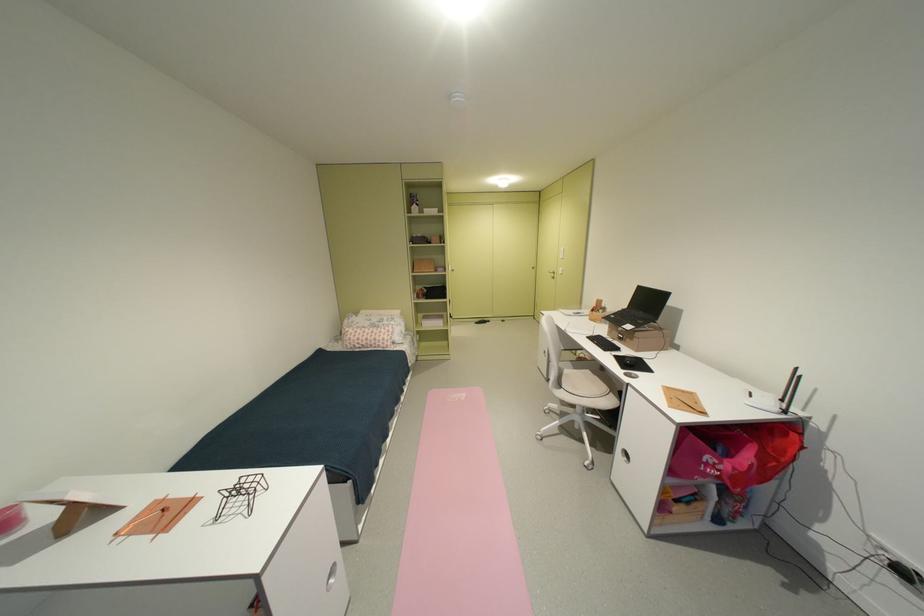
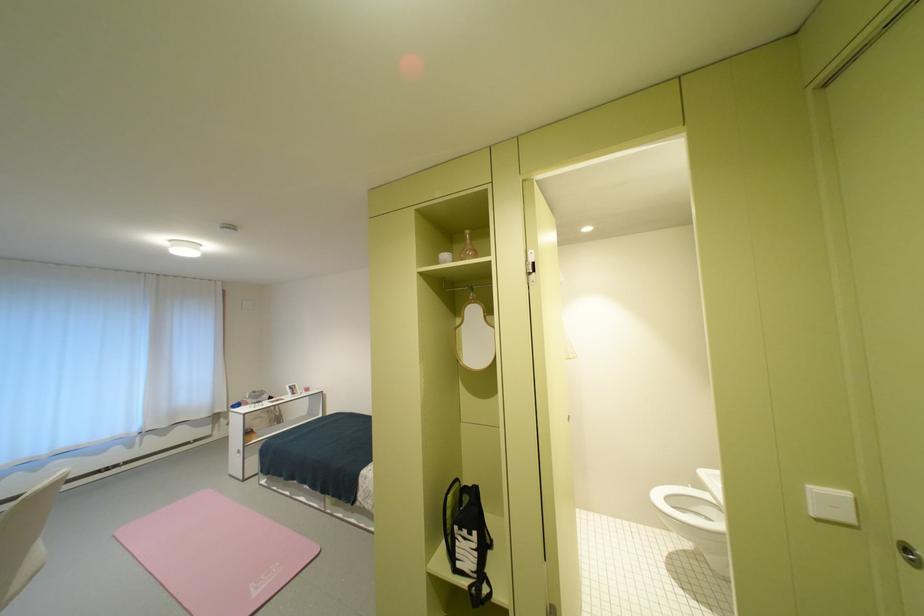
Where in the second image is the point corresponding to point 457,400 from the first image?

(286, 565)